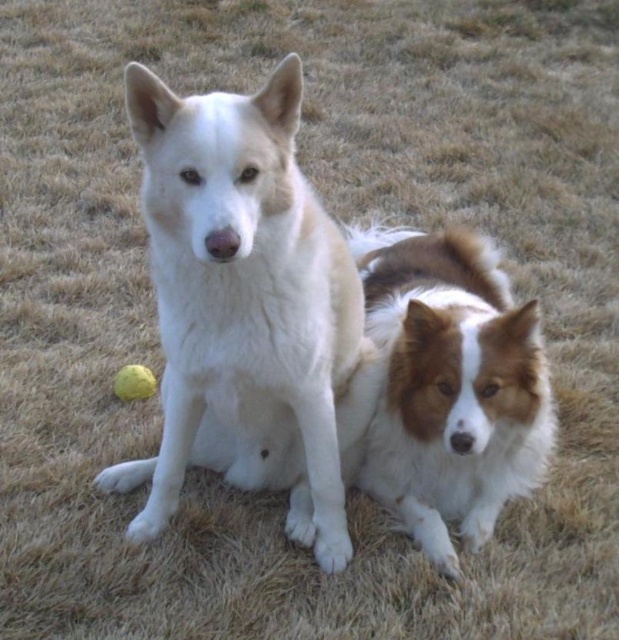
Is white fur dog at center bigger than brown/white fur dog at lower right?

Yes.

Does white fur dog at center have a lesser height compared to brown/white fur dog at lower right?

No, white fur dog at center is not shorter than brown/white fur dog at lower right.

Where is `white fur dog at center`? Image resolution: width=619 pixels, height=640 pixels. white fur dog at center is located at coordinates (248, 308).